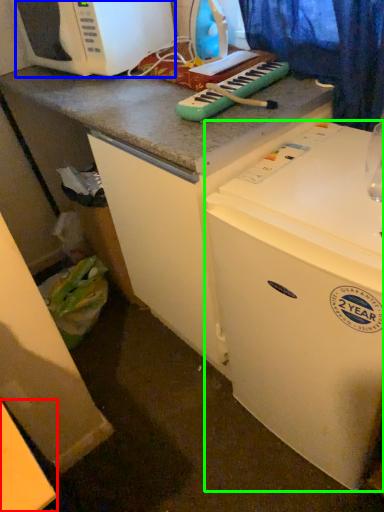
Question: Estimate the real-world distances between objects in this image. Which object is closer to counter top (highlighted by a red box), microwave oven (highlighted by a blue box) or refrigerator (highlighted by a green box)?

Choices:
 (A) microwave oven
 (B) refrigerator

Answer: (B)